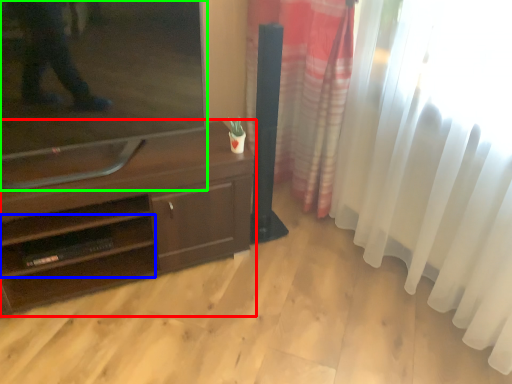
Question: Which object is the closest to the desk (highlighted by a red box)? Choose among these: shelf (highlighted by a blue box) or television (highlighted by a green box).

Choices:
 (A) shelf
 (B) television

Answer: (A)